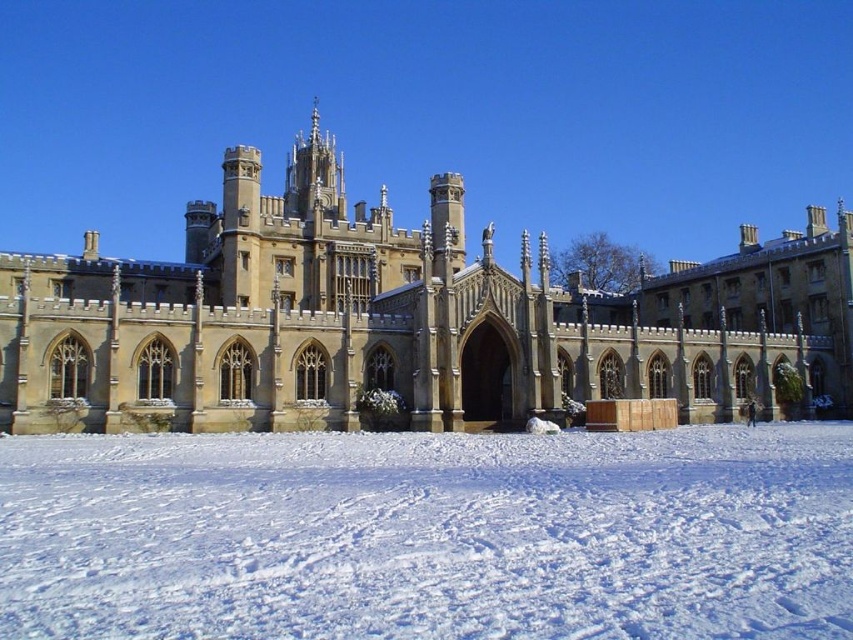
Question: Which object is farther from the camera taking this photo?

Choices:
 (A) white powdery snow at lower center
 (B) golden stone palace at center

Answer: (B)

Question: Which object appears closest to the camera in this image?

Choices:
 (A) white powdery snow at lower center
 (B) golden stone palace at center

Answer: (A)

Question: Is white powdery snow at lower center positioned before golden stone palace at center?

Choices:
 (A) yes
 (B) no

Answer: (A)

Question: Can you confirm if white powdery snow at lower center is wider than golden stone palace at center?

Choices:
 (A) yes
 (B) no

Answer: (B)

Question: Which object is farther from the camera taking this photo?

Choices:
 (A) white powdery snow at lower center
 (B) golden stone palace at center

Answer: (B)

Question: Can you confirm if white powdery snow at lower center is positioned below golden stone palace at center?

Choices:
 (A) yes
 (B) no

Answer: (A)